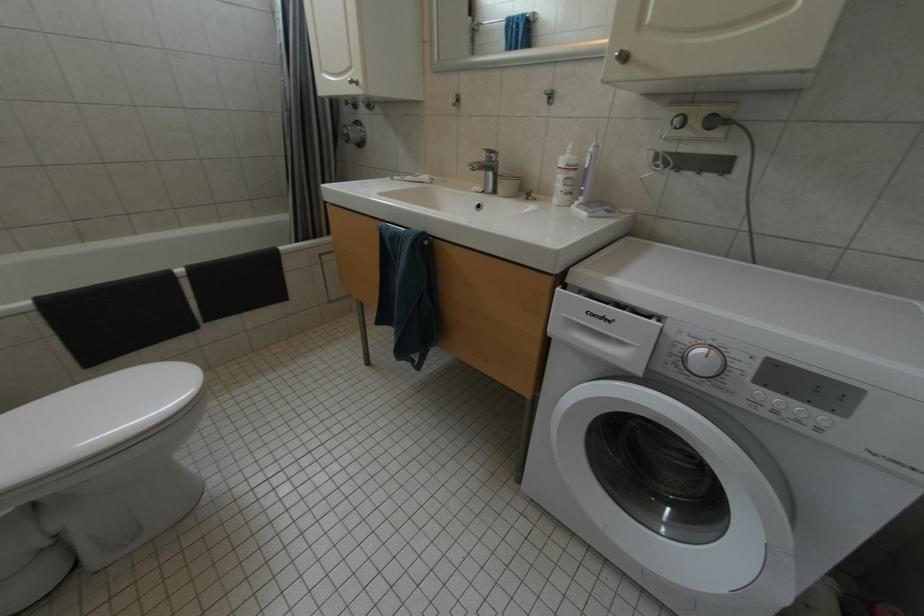
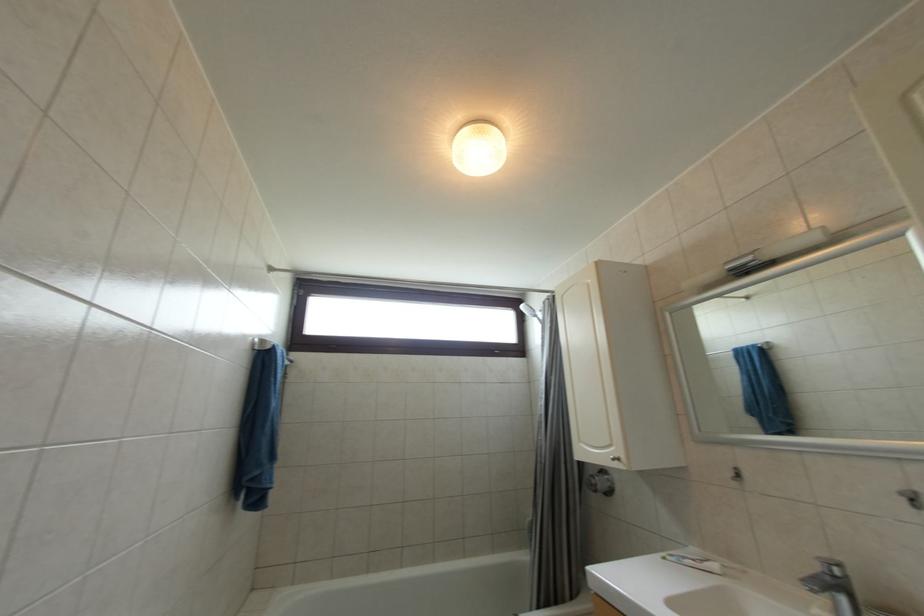
Based on the continuous images, in which direction is the camera rotating?

The camera's rotation is toward left-up.